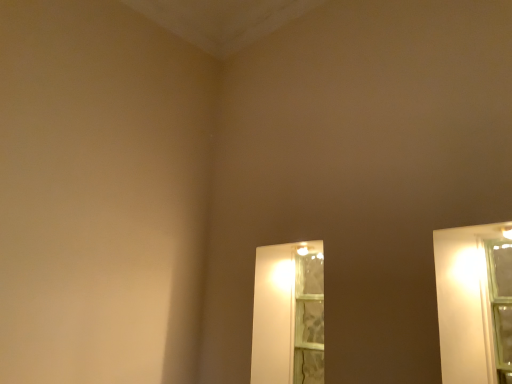
At what (x,y) coordinates should I click in order to perform the action: click on clear glass window at center. Please return your answer as a coordinate pair (x, y). The image size is (512, 384). Looking at the image, I should click on (309, 319).

Describe the element at coordinates (309, 319) in the screenshot. The image size is (512, 384). I see `clear glass window at center` at that location.

Find the location of a particular element. The height and width of the screenshot is (384, 512). clear glass window at center is located at coordinates (309, 319).